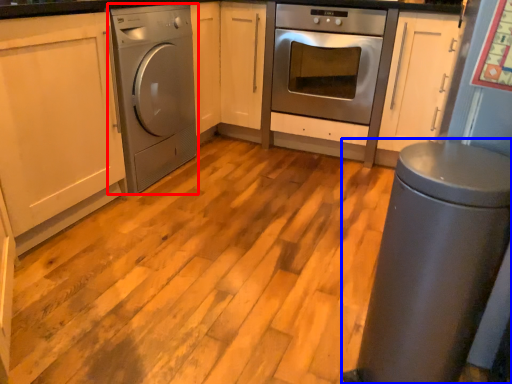
Question: Which point is further to the camera, home appliance (highlighted by a red box) or gray (highlighted by a blue box)?

Choices:
 (A) home appliance
 (B) gray

Answer: (A)